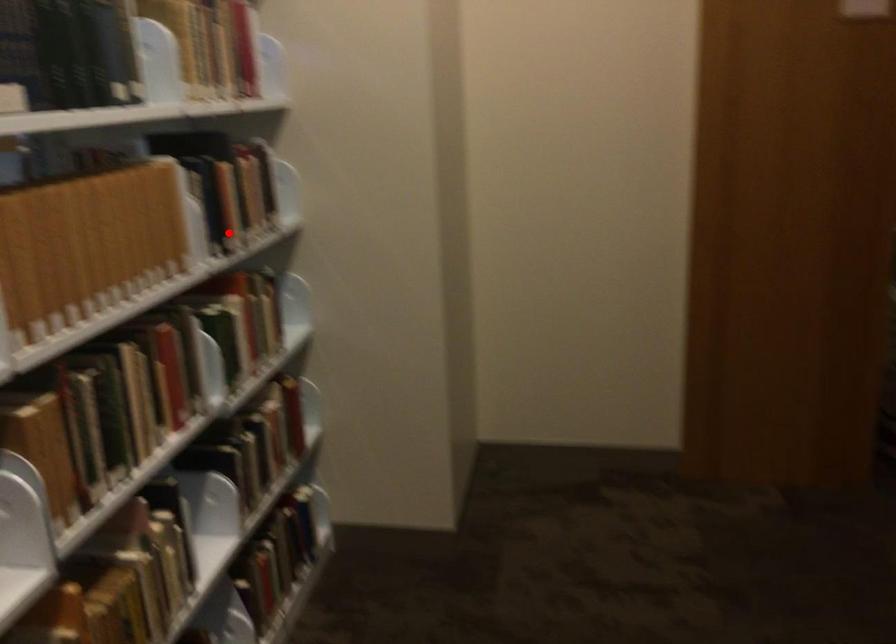
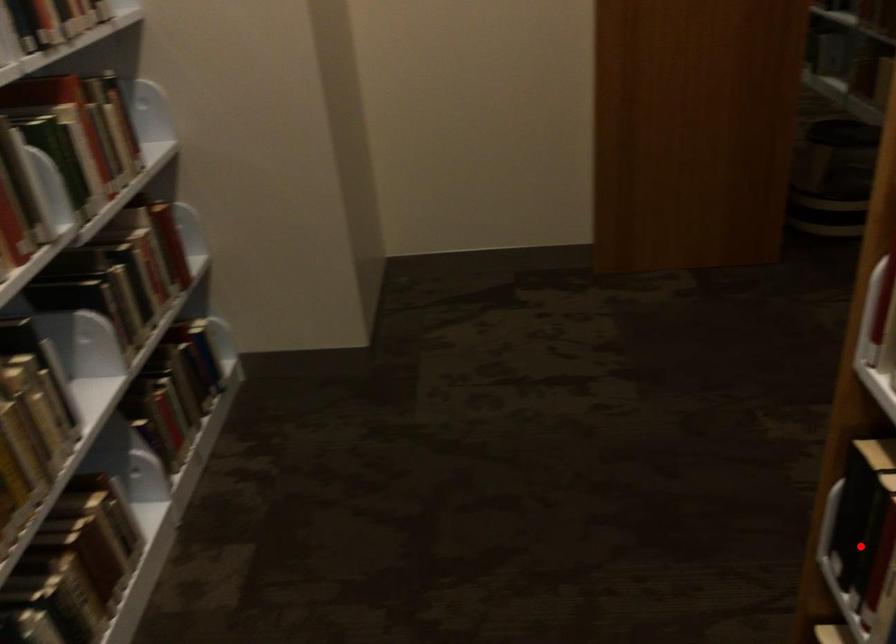
I am providing you with two images of the same scene from different viewpoints. A red point is marked on the first image and another point is marked on the second image. Does the point marked in image1 correspond to the same location as the one in image2?

No